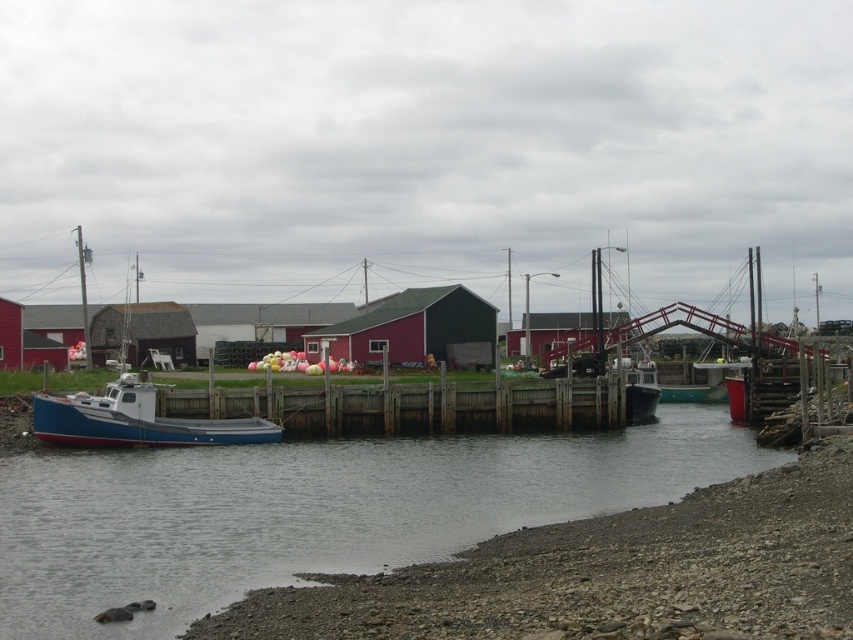
Question: Among these objects, which one is farthest from the camera?

Choices:
 (A) red wood barn at center
 (B) blue polished wood boat at center
 (C) red corrugated metal hut at center
 (D) blue matte water at lower left

Answer: (A)

Question: Is blue polished wood boat at center thinner than red wood barn at left?

Choices:
 (A) yes
 (B) no

Answer: (A)

Question: Does blue matte water at lower left appear on the left side of blue polished wood boat at center?

Choices:
 (A) no
 (B) yes

Answer: (A)

Question: Which point is farther to the camera?

Choices:
 (A) (27, 368)
 (B) (369, 344)

Answer: (B)

Question: Is blue matte water at lower left to the left of blue polished wood boat at center from the viewer's perspective?

Choices:
 (A) yes
 (B) no

Answer: (B)

Question: Among these points, which one is farthest from the camera?

Choices:
 (A) (418, 364)
 (B) (540, 342)

Answer: (B)